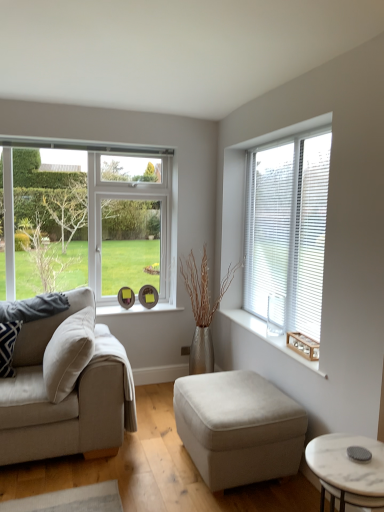
You are a GUI agent. You are given a task and a screenshot of the screen. Output one action in this format:
    pyautogui.click(x=<x>, y=<y>)
    Task: Click on the free location above white marble coffee table at lower right (from a real-world perspective)
    Image resolution: width=384 pixels, height=512 pixels.
    Given the screenshot: What is the action you would take?
    pyautogui.click(x=347, y=458)